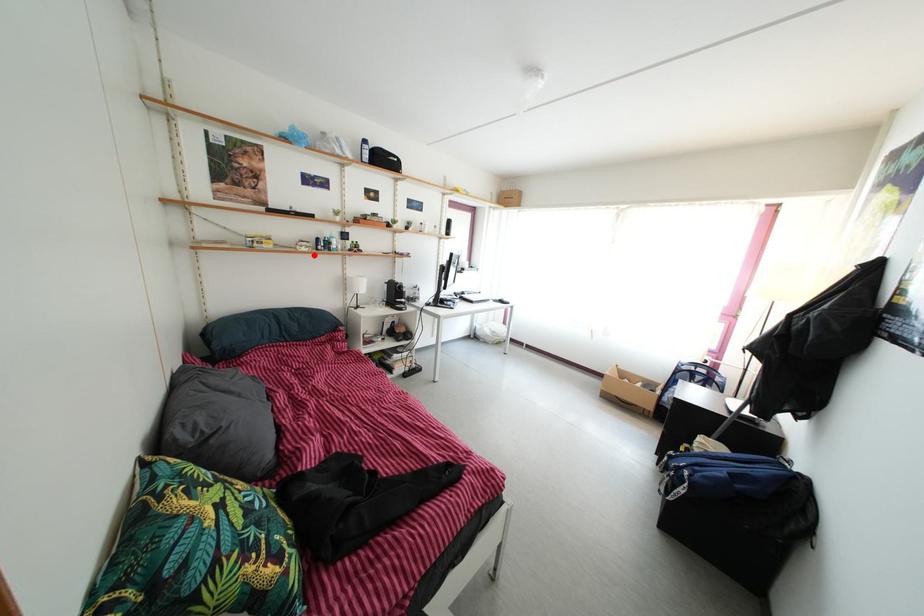
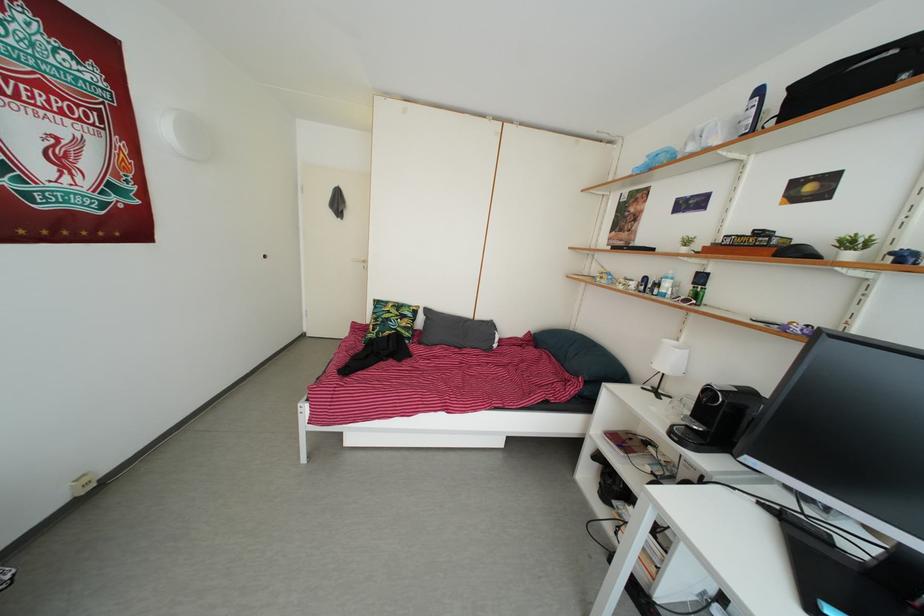
Question: I am providing you with two images of the same scene from different viewpoints. Given a red point in image1, look at the same physical point in image2. Is it:

Choices:
 (A) Closer to the viewpoint
 (B) Farther from the viewpoint

Answer: (B)